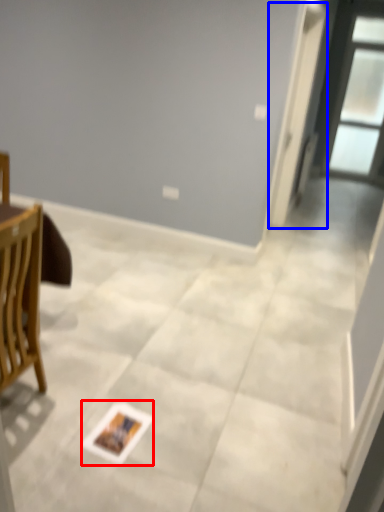
Question: Which object is closer to the camera taking this photo, postcard (highlighted by a red box) or screen door (highlighted by a blue box)?

Choices:
 (A) postcard
 (B) screen door

Answer: (A)